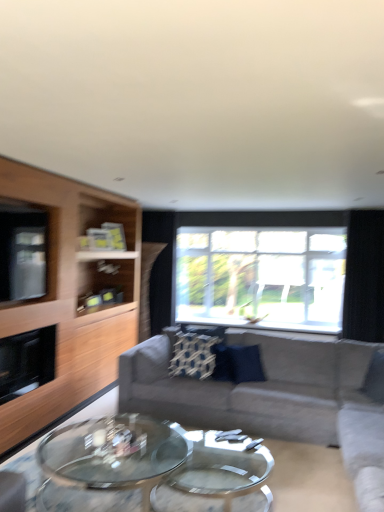
Question: Could you tell me if light wood entertainment center at left is turned towards black matte fireplace at left?

Choices:
 (A) yes
 (B) no

Answer: (A)

Question: Can you confirm if light wood entertainment center at left is thinner than black matte fireplace at left?

Choices:
 (A) no
 (B) yes

Answer: (A)

Question: From the image's perspective, is light wood entertainment center at left under black matte fireplace at left?

Choices:
 (A) no
 (B) yes

Answer: (A)

Question: Is the position of light wood entertainment center at left more distant than that of black matte fireplace at left?

Choices:
 (A) yes
 (B) no

Answer: (B)

Question: Is black matte fireplace at left completely or partially inside light wood entertainment center at left?

Choices:
 (A) yes
 (B) no

Answer: (A)

Question: Would you consider light wood entertainment center at left to be distant from black matte fireplace at left?

Choices:
 (A) no
 (B) yes

Answer: (A)

Question: Are black matte fireplace at left and black fabric curtain at right located far from each other?

Choices:
 (A) yes
 (B) no

Answer: (A)

Question: Is black matte fireplace at left bigger than black fabric curtain at right?

Choices:
 (A) yes
 (B) no

Answer: (B)

Question: From a real-world perspective, is black matte fireplace at left on black fabric curtain at right?

Choices:
 (A) yes
 (B) no

Answer: (B)

Question: Is black matte fireplace at left facing towards black fabric curtain at right?

Choices:
 (A) yes
 (B) no

Answer: (B)

Question: Are black matte fireplace at left and black fabric curtain at right beside each other?

Choices:
 (A) yes
 (B) no

Answer: (B)

Question: Is black matte fireplace at left located outside black fabric curtain at right?

Choices:
 (A) no
 (B) yes

Answer: (B)

Question: Are transparent glass window at center and gray fabric couch at center located far from each other?

Choices:
 (A) no
 (B) yes

Answer: (B)